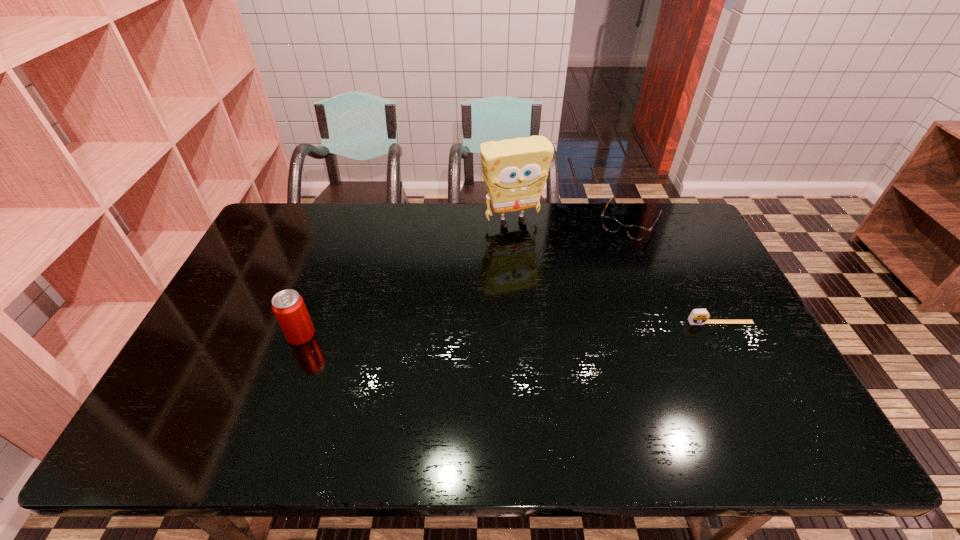
Locate an element on the screen. This screenshot has height=540, width=960. vacant space that's between the tallest object and the spectacles is located at coordinates (571, 222).

The width and height of the screenshot is (960, 540). What are the coordinates of `unoccupied area between the sponge and the spectacles` in the screenshot? It's located at (571, 222).

Where is `free point between the tallest object and the shortest object`? free point between the tallest object and the shortest object is located at coordinates (616, 272).

This screenshot has width=960, height=540. What are the coordinates of `empty space that is in between the third object from right to left and the second tallest object` in the screenshot? It's located at (407, 279).

Where is `free space between the spectacles and the shortest object`? The height and width of the screenshot is (540, 960). free space between the spectacles and the shortest object is located at coordinates (675, 272).

Identify which object is the closest to the sponge. Please provide its 2D coordinates. Your answer should be formatted as a tuple, i.e. [(x, y)], where the tuple contains the x and y coordinates of a point satisfying the conditions above.

[(610, 224)]

Identify the location of object that is the nearest to the second shortest object. (515, 170).

Locate an element on the screen. vacant area in the image that satisfies the following two spatial constraints: 1. on the back side of the spectacles; 2. on the left side of the can is located at coordinates (343, 222).

At what (x,y) coordinates should I click in order to perform the action: click on vacant area in the image that satisfies the following two spatial constraints: 1. on the front side of the spectacles; 2. on the left side of the sponge. Please return your answer as a coordinate pair (x, y). This screenshot has width=960, height=540. Looking at the image, I should click on (513, 222).

Locate an element on the screen. This screenshot has width=960, height=540. vacant region that satisfies the following two spatial constraints: 1. on the back side of the can; 2. on the left side of the second object from left to right is located at coordinates (343, 222).